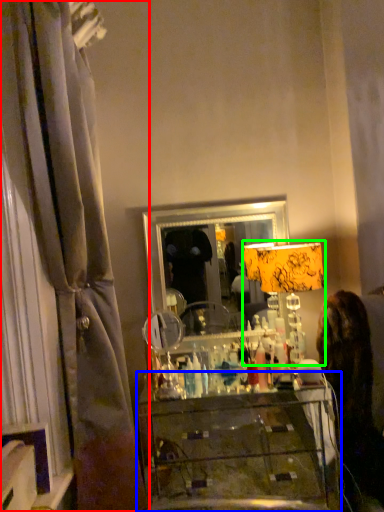
Question: Which object is positioned closest to curtain (highlighted by a red box)? Select from furniture (highlighted by a blue box) and table lamp (highlighted by a green box).

Choices:
 (A) furniture
 (B) table lamp

Answer: (B)